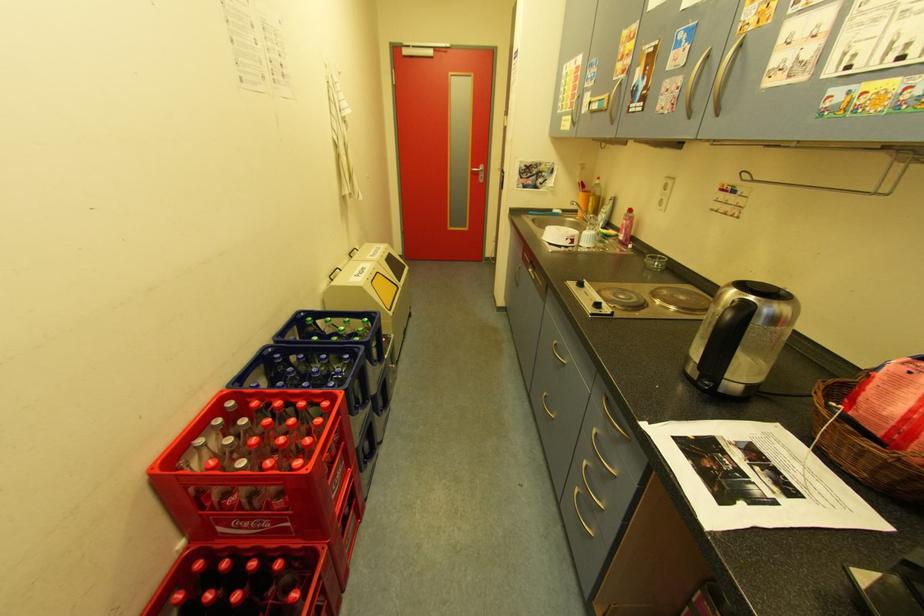
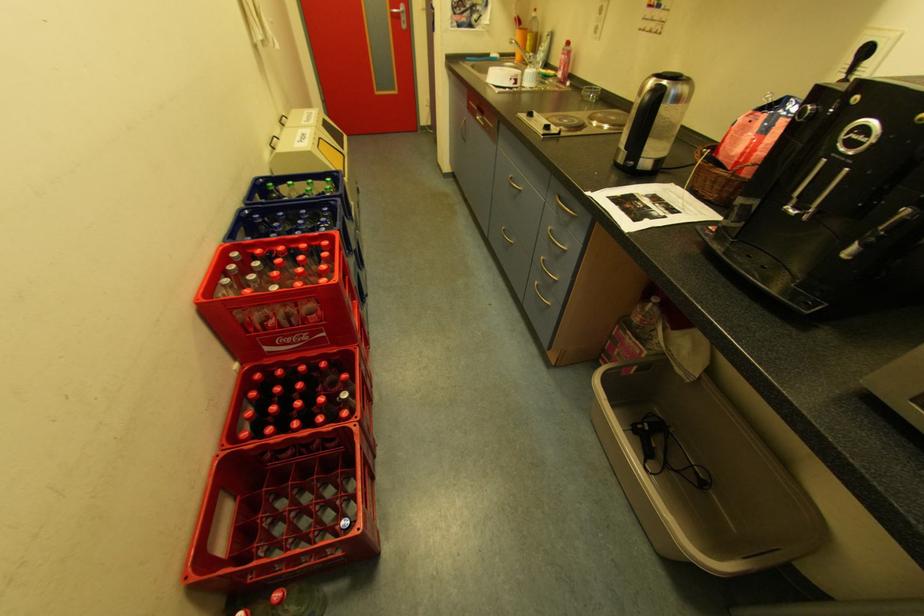
Question: How did the camera likely rotate?

Choices:
 (A) Left
 (B) Right
 (C) Up
 (D) Down

Answer: (D)